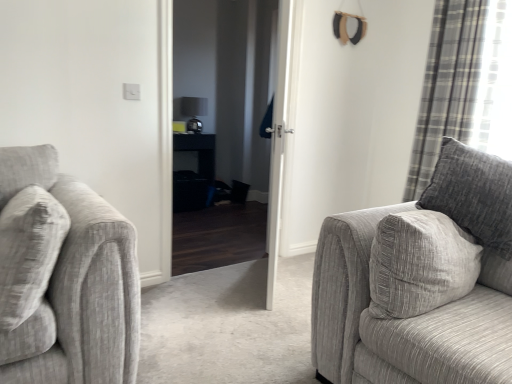
Question: From the image's perspective, is plaid fabric curtain at right above or below textured gray couch at right?

Choices:
 (A) below
 (B) above

Answer: (B)

Question: Considering the positions of point (437, 31) and point (347, 299), is point (437, 31) closer or farther from the camera than point (347, 299)?

Choices:
 (A) closer
 (B) farther

Answer: (B)

Question: Which is nearer to the white glossy door at center?

Choices:
 (A) plaid fabric curtain at right
 (B) textured gray couch at right
 (C) black glossy table at center
 (D) black glossy door at center

Answer: (B)

Question: Which object is the closest to the white glossy door at center?

Choices:
 (A) black glossy table at center
 (B) plaid fabric curtain at right
 (C) black glossy door at center
 (D) textured gray couch at right

Answer: (D)